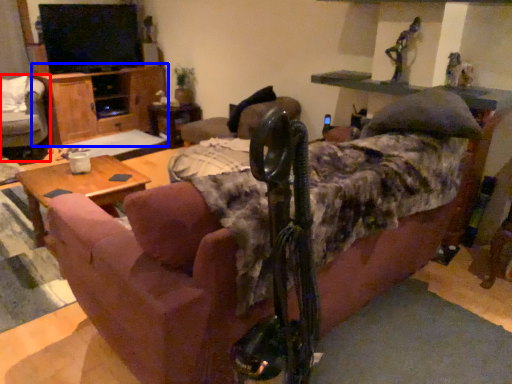
Question: Which point is closer to the camera, chair (highlighted by a red box) or dresser (highlighted by a blue box)?

Choices:
 (A) chair
 (B) dresser

Answer: (A)